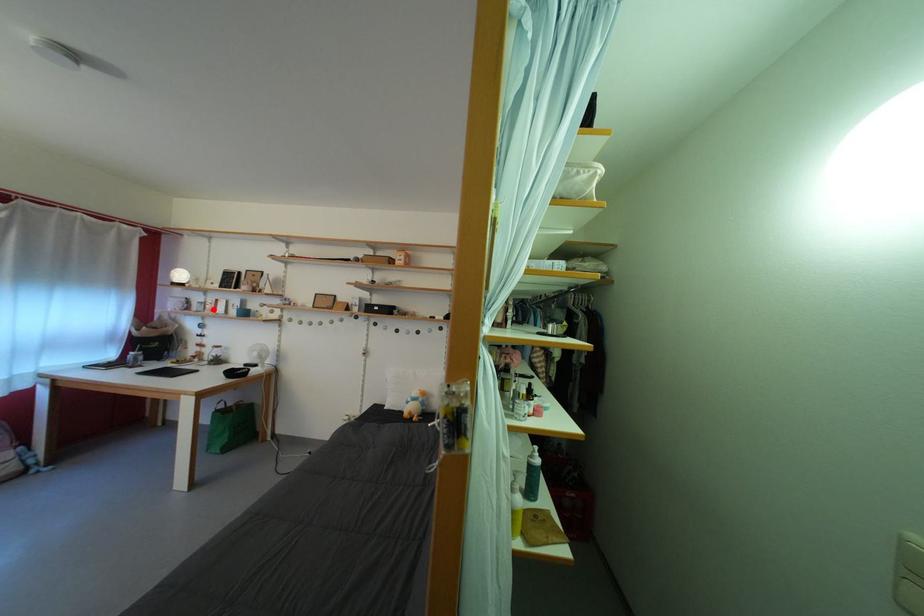
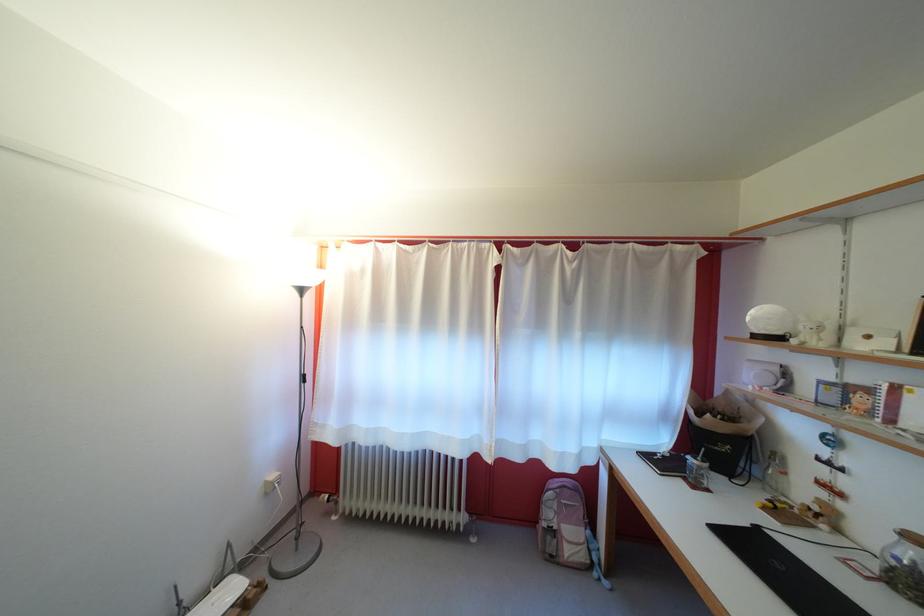
In the second image, find the point that corresponds to the highlighted location in the first image.

(855, 395)